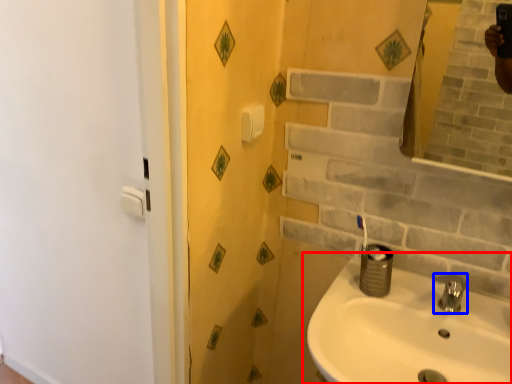
Question: Among these objects, which one is farthest to the camera, sink (highlighted by a red box) or tap (highlighted by a blue box)?

Choices:
 (A) sink
 (B) tap

Answer: (B)